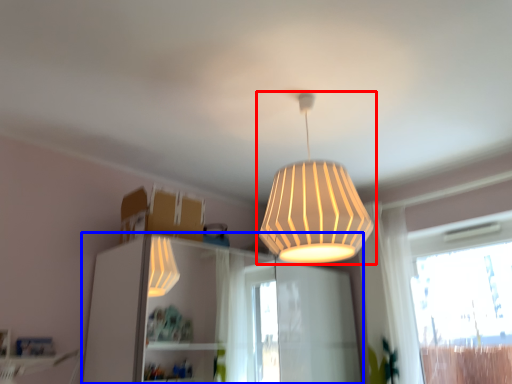
Question: Which point is closer to the camera, lamp (highlighted by a red box) or dresser (highlighted by a blue box)?

Choices:
 (A) lamp
 (B) dresser

Answer: (A)